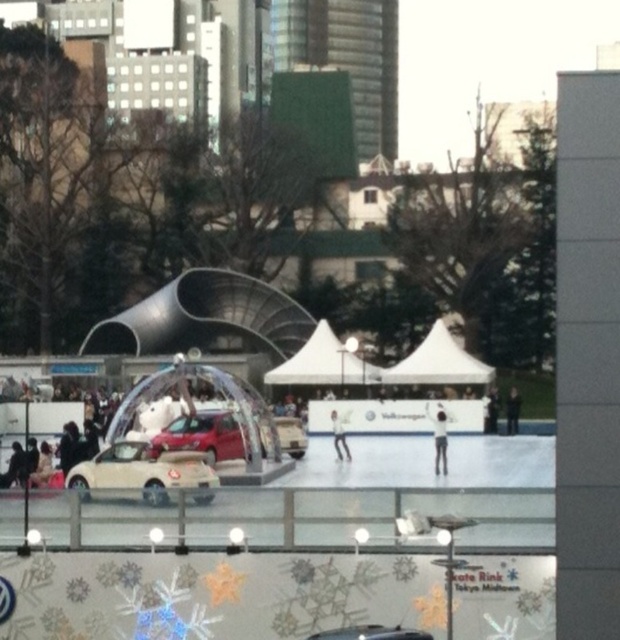
Question: Can you confirm if matte red car at center is positioned above white matte figure skater at center?

Choices:
 (A) no
 (B) yes

Answer: (A)

Question: Considering the real-world distances, which object is farthest from the smooth white figure skater at center?

Choices:
 (A) white matte figure skater at center
 (B) matte red car at center

Answer: (B)

Question: Which point is closer to the camera?

Choices:
 (A) matte silver car at center
 (B) white matte figure skater at center
 (C) smooth white figure skater at center
 (D) matte red car at center

Answer: (A)

Question: Which object is farther from the camera taking this photo?

Choices:
 (A) dark gray jacket at center
 (B) smooth white figure skater at center

Answer: (A)

Question: Does beige matte car at center have a greater width compared to matte red car at center?

Choices:
 (A) no
 (B) yes

Answer: (B)

Question: Is beige matte car at center positioned in front of smooth white figure skater at center?

Choices:
 (A) yes
 (B) no

Answer: (A)